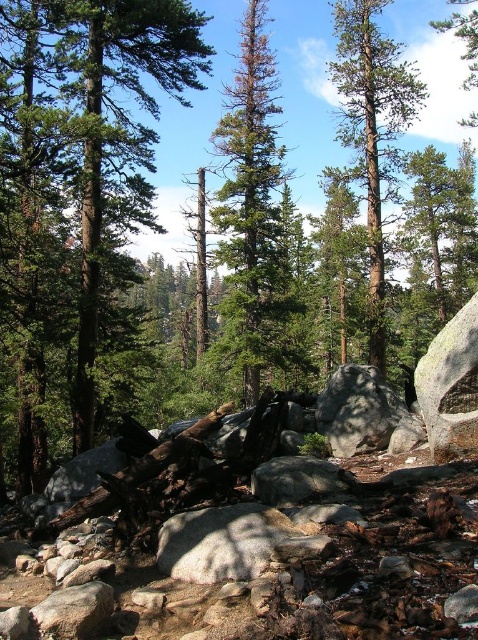
Does green textured tree at center appear under gray rough boulder at center?

Actually, green textured tree at center is above gray rough boulder at center.

Does point (376, 129) come farther from viewer compared to point (359, 436)?

Yes, point (376, 129) is behind point (359, 436).

I want to click on green textured tree at center, so click(x=371, y=124).

Who is more distant from viewer, (80, 369) or (248, 212)?

Positioned behind is point (248, 212).

Can you confirm if green leafy tree at center is thinner than green textured pine tree at center?

No.

You are a GUI agent. You are given a task and a screenshot of the screen. Output one action in this format:
    pyautogui.click(x=<x>, y=<y>)
    Task: Click on the green leafy tree at center
    
    Given the screenshot: What is the action you would take?
    (75, 193)

Locate an element on the screen. The width and height of the screenshot is (478, 640). green leafy tree at center is located at coordinates (75, 193).

Does green leafy tree at center appear on the left side of green textured tree at center?

Indeed, green leafy tree at center is positioned on the left side of green textured tree at center.

Does green leafy tree at center have a greater height compared to green textured tree at center?

In fact, green leafy tree at center may be shorter than green textured tree at center.

Locate an element on the screen. green leafy tree at center is located at coordinates (75, 193).